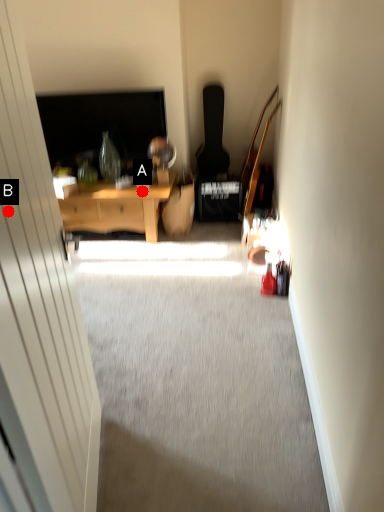
Question: Two points are circled on the image, labeled by A and B beside each circle. Which point is farther to the camera?

Choices:
 (A) A is further
 (B) B is further

Answer: (A)